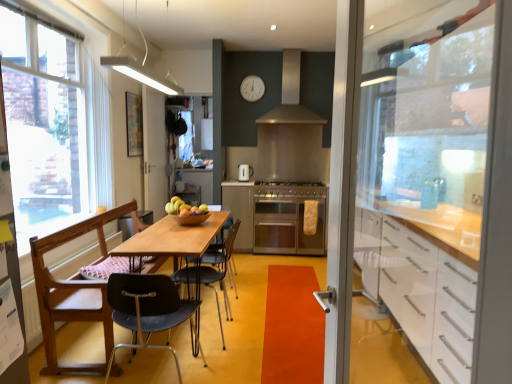
What are the coordinates of `vacant space to the right of black plastic chair at center, the third chair in the front-to-back sequence` in the screenshot? It's located at (260, 329).